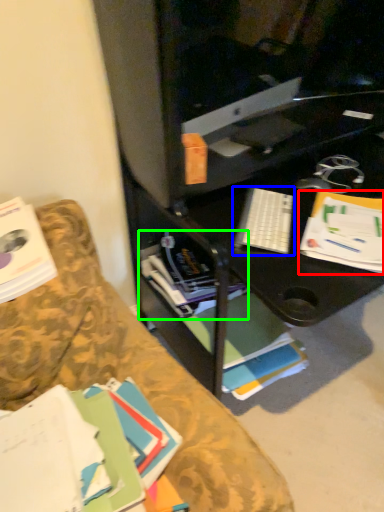
Question: Based on their relative distances, which object is farther from paperback book (highlighted by a red box)? Choose from keyboard (highlighted by a blue box) and book (highlighted by a green box).

Choices:
 (A) keyboard
 (B) book

Answer: (B)